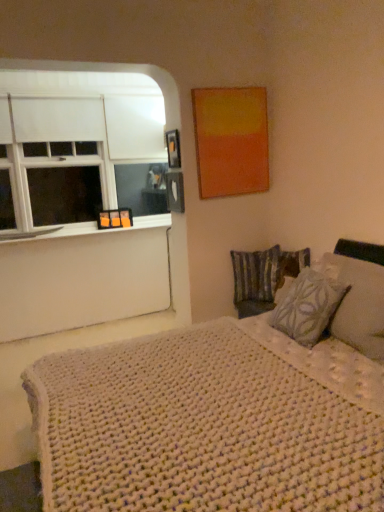
Question: From the image's perspective, is white matte window at left beneath white knitted blanket at lower right?

Choices:
 (A) no
 (B) yes

Answer: (A)

Question: Does white matte window at left lie behind white knitted blanket at lower right?

Choices:
 (A) no
 (B) yes

Answer: (B)

Question: Is white matte window at left positioned before white knitted blanket at lower right?

Choices:
 (A) yes
 (B) no

Answer: (B)

Question: Is white matte window at left in contact with white knitted blanket at lower right?

Choices:
 (A) yes
 (B) no

Answer: (B)

Question: Is white matte window at left not near white knitted blanket at lower right?

Choices:
 (A) yes
 (B) no

Answer: (A)

Question: From the image's perspective, relative to metallic photo frame at upper center, is white matte window at left above or below?

Choices:
 (A) above
 (B) below

Answer: (A)

Question: From their relative heights in the image, would you say white matte window at left is taller or shorter than metallic photo frame at upper center?

Choices:
 (A) tall
 (B) short

Answer: (A)

Question: Based on their sizes in the image, would you say white matte window at left is bigger or smaller than metallic photo frame at upper center?

Choices:
 (A) big
 (B) small

Answer: (A)

Question: Which is correct: white matte window at left is inside metallic photo frame at upper center, or outside of it?

Choices:
 (A) outside
 (B) inside

Answer: (A)

Question: In terms of height, does metallic photo frame at upper center look taller or shorter compared to patterned fabric pillow at right, the 2th pillow when ordered from back to front?

Choices:
 (A) tall
 (B) short

Answer: (B)

Question: Is point (172, 136) closer or farther from the camera than point (309, 342)?

Choices:
 (A) closer
 (B) farther

Answer: (B)

Question: From a real-world perspective, relative to patterned fabric pillow at right, marked as the first pillow in a front-to-back arrangement, is metallic photo frame at upper center vertically above or below?

Choices:
 (A) below
 (B) above

Answer: (B)

Question: Considering their positions, is metallic photo frame at upper center located in front of or behind patterned fabric pillow at right, marked as the first pillow in a front-to-back arrangement?

Choices:
 (A) behind
 (B) front

Answer: (A)

Question: Considering the relative positions of patterned fabric pillow at right, the 2th pillow when ordered from back to front, and striped fabric pillow at center-right, the 2th pillow in the front-to-back sequence, in the image provided, is patterned fabric pillow at right, the 2th pillow when ordered from back to front, to the left or to the right of striped fabric pillow at center-right, the 2th pillow in the front-to-back sequence,?

Choices:
 (A) right
 (B) left

Answer: (A)

Question: Considering the positions of point (329, 323) and point (263, 291), is point (329, 323) closer or farther from the camera than point (263, 291)?

Choices:
 (A) farther
 (B) closer

Answer: (B)